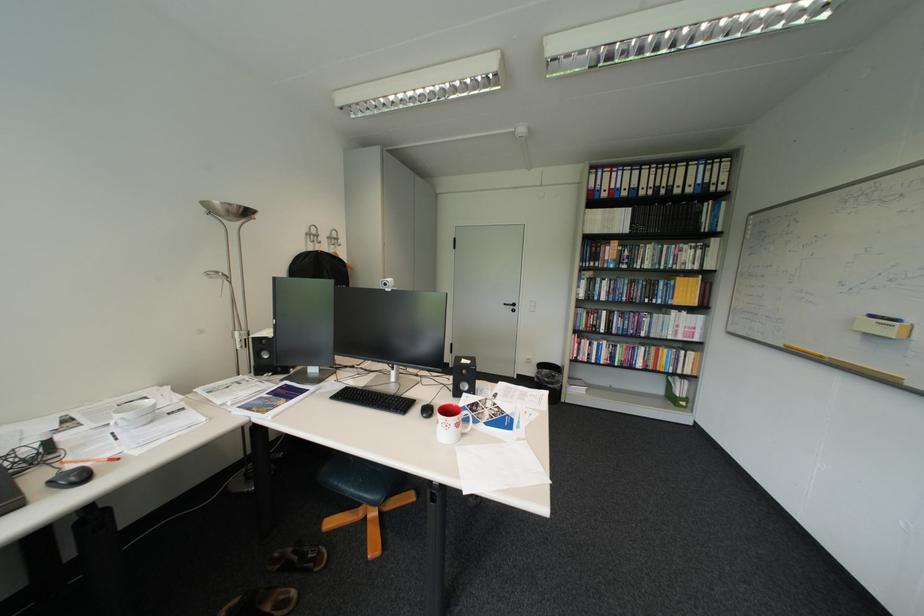
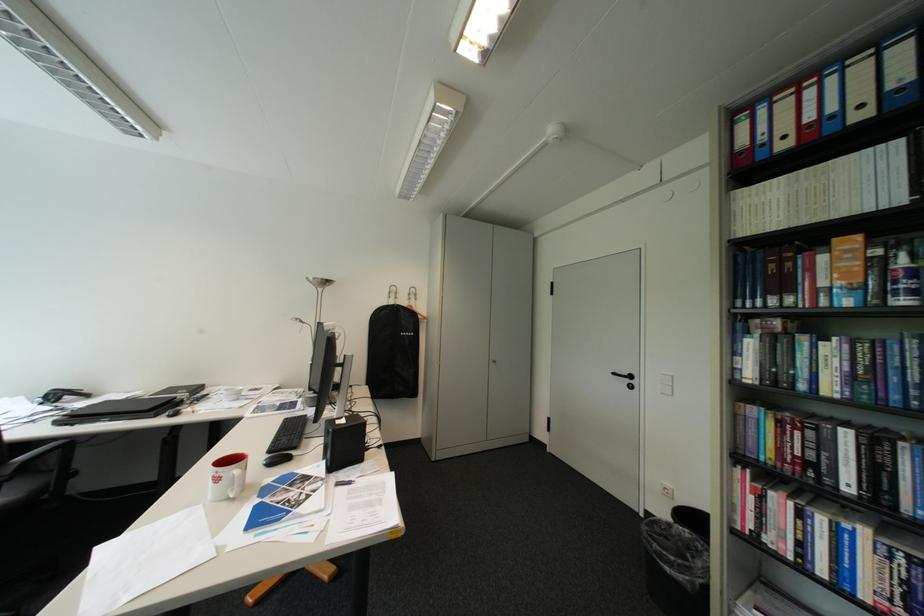
Where in the second image is the point corresponding to (624,241) from the first image?

(848, 240)